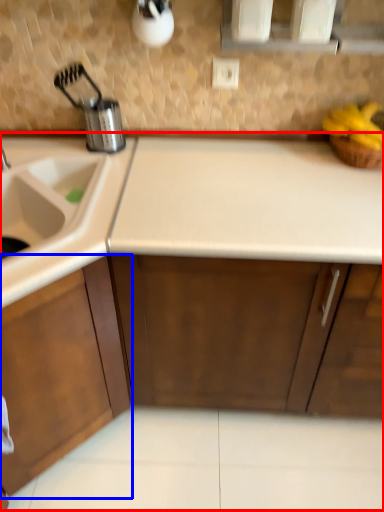
Question: Which point is further to the camera, countertop (highlighted by a red box) or cabinetry (highlighted by a blue box)?

Choices:
 (A) countertop
 (B) cabinetry

Answer: (A)